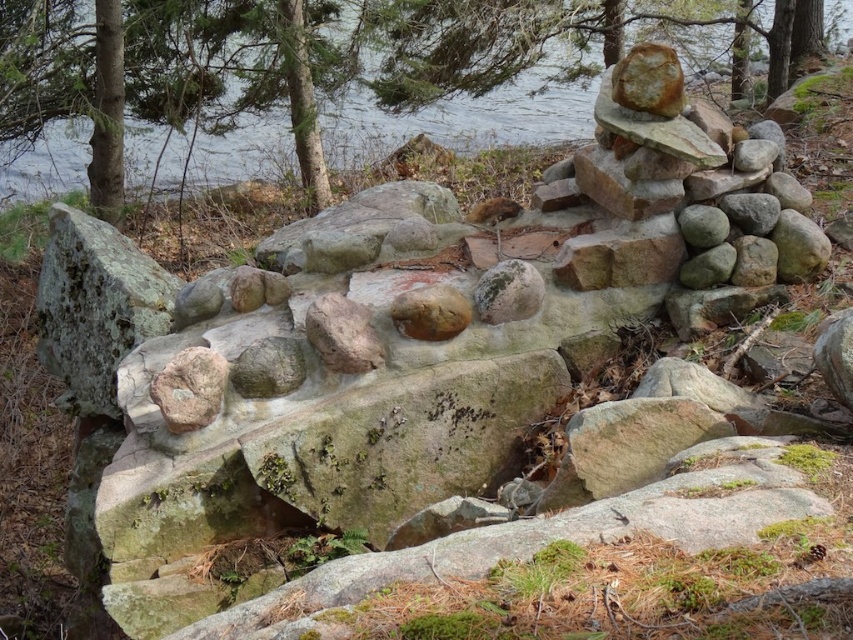
Question: Does rusty metallic rock at upper center appear on the right side of rusty metallic rock at center?

Choices:
 (A) no
 (B) yes

Answer: (B)

Question: Can you confirm if green mossy tree at upper center is positioned below rusty metallic rock at center?

Choices:
 (A) yes
 (B) no

Answer: (B)

Question: Observing the image, what is the correct spatial positioning of smooth gray rock at center in reference to rusty metallic rock at center?

Choices:
 (A) above
 (B) below

Answer: (B)

Question: Which object appears closest to the camera in this image?

Choices:
 (A) smooth gray rock at center
 (B) rusty metallic rock at center
 (C) green mossy tree at upper center

Answer: (A)

Question: Which point is farther from the camera taking this photo?

Choices:
 (A) (320, 156)
 (B) (450, 326)

Answer: (A)

Question: Estimate the real-world distances between objects in this image. Which object is closer to the green mossy rock at upper center?

Choices:
 (A) mossy rock at center
 (B) rusty brown rock at center

Answer: (A)